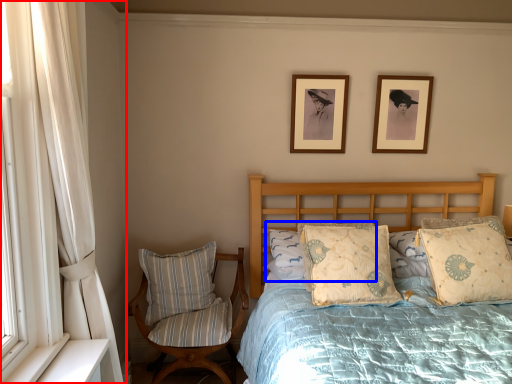
Question: Which object is further to the camera taking this photo, curtain (highlighted by a red box) or pillow (highlighted by a blue box)?

Choices:
 (A) curtain
 (B) pillow

Answer: (B)